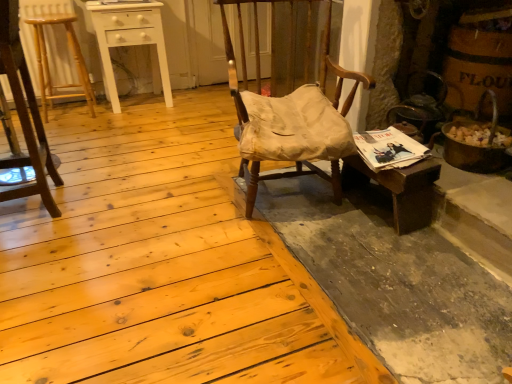
This screenshot has height=384, width=512. I want to click on unoccupied region to the right of white wood table at upper left, so click(x=187, y=105).